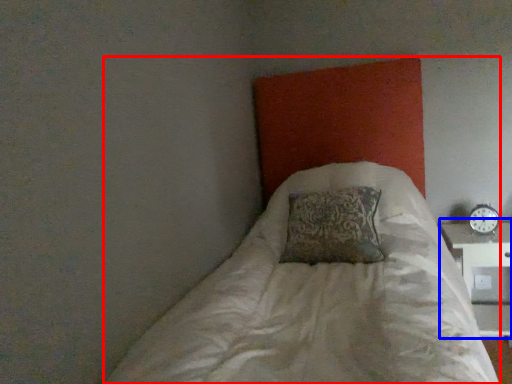
Question: Among these objects, which one is nearest to the camera, bed (highlighted by a red box) or table (highlighted by a blue box)?

Choices:
 (A) bed
 (B) table

Answer: (A)